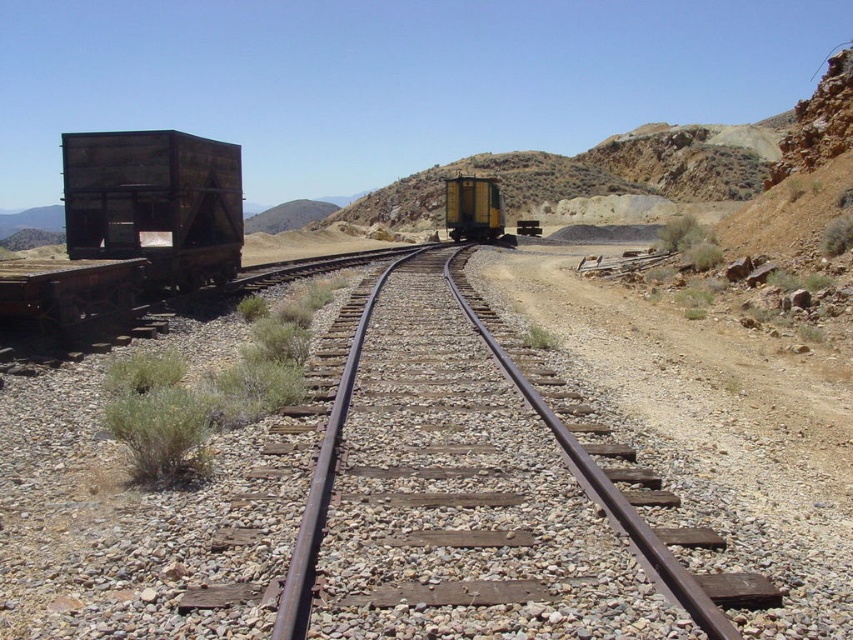
Question: In this image, where is weathered wood train car at left located relative to yellow matte train car at center?

Choices:
 (A) right
 (B) left

Answer: (B)

Question: Does rusty metal track at center have a larger size compared to yellow matte train car at center?

Choices:
 (A) yes
 (B) no

Answer: (B)

Question: Among these points, which one is farthest from the camera?

Choices:
 (A) (206, 193)
 (B) (454, 208)

Answer: (B)

Question: Which of the following is the closest to the observer?

Choices:
 (A) weathered wood train car at left
 (B) rusty metal track at center

Answer: (B)

Question: Does weathered wood train car at left have a smaller size compared to rusty metal track at center?

Choices:
 (A) yes
 (B) no

Answer: (B)

Question: Estimate the real-world distances between objects in this image. Which object is closer to the yellow matte train car at center?

Choices:
 (A) rusty metal track at center
 (B) weathered wood train car at left

Answer: (B)